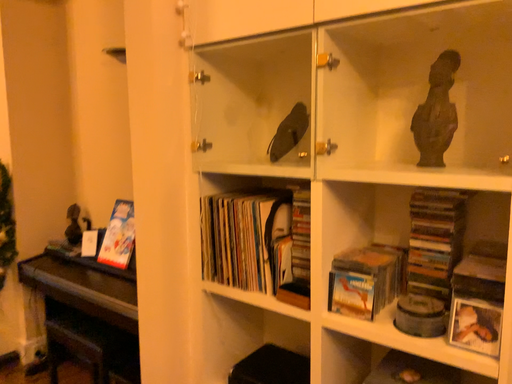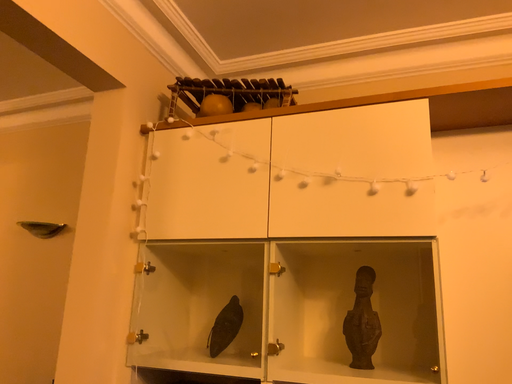
Question: How did the camera likely rotate when shooting the video?

Choices:
 (A) rotated right
 (B) rotated left

Answer: (A)